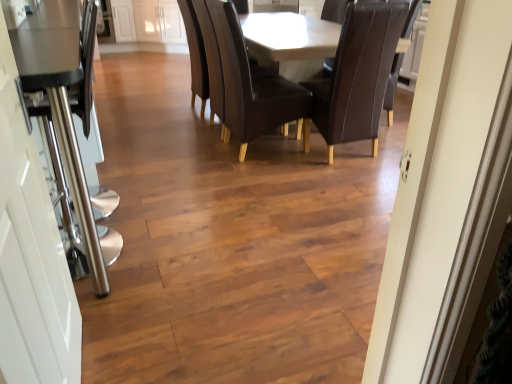
Identify the location of brown leather chair at center, the 2th chair when ordered from left to right. The height and width of the screenshot is (384, 512). (358, 75).

Where is `white glossy door at left`? The width and height of the screenshot is (512, 384). white glossy door at left is located at coordinates (31, 256).

Where is `matte brown table at center`? matte brown table at center is located at coordinates (239, 82).

The image size is (512, 384). In order to click on brown leather chair at center, the 1th chair from the right in this screenshot , I will do `click(358, 75)`.

From a real-world perspective, is matte brown table at center positioned under dark brown leather armchair at center based on gravity?

Indeed, from a real-world perspective, matte brown table at center is positioned beneath dark brown leather armchair at center.

Is matte brown table at center to the left or to the right of dark brown leather armchair at center in the image?

matte brown table at center is positioned on dark brown leather armchair at center's right side.

Is matte brown table at center in front of or behind dark brown leather armchair at center in the image?

matte brown table at center is positioned closer to the viewer than dark brown leather armchair at center.

In the scene shown: Can you tell me how much matte brown table at center and dark brown leather armchair at center differ in facing direction?

There is a 178-degree angle between the facing directions of matte brown table at center and dark brown leather armchair at center.

Considering the sizes of objects brown leather chair at center, the 2th chair when ordered from left to right, and dark brown leather armchair at center in the image provided, who is thinner, brown leather chair at center, the 2th chair when ordered from left to right, or dark brown leather armchair at center?

Thinner between the two is dark brown leather armchair at center.

Is brown leather chair at center, the 1th chair from the right, inside the boundaries of dark brown leather armchair at center, or outside?

brown leather chair at center, the 1th chair from the right, is spatially situated outside dark brown leather armchair at center.

Is brown leather chair at center, the 2th chair when ordered from left to right, oriented towards dark brown leather armchair at center?

No, brown leather chair at center, the 2th chair when ordered from left to right, is not aimed at dark brown leather armchair at center.

The image size is (512, 384). Identify the location of the 2nd chair in front of the dark brown leather armchair at center, starting your count from the anchor. (358, 75).

From the image's perspective, who appears lower, brown leather chair at center, acting as the first chair starting from the left, or matte brown table at center?

brown leather chair at center, acting as the first chair starting from the left, is shown below in the image.

Is brown leather chair at center, which is the 2th chair from right to left, outside of matte brown table at center?

No, brown leather chair at center, which is the 2th chair from right to left, is not entirely external to matte brown table at center.

Considering the relative positions of brown leather chair at center, acting as the first chair starting from the left, and matte brown table at center in the image provided, is brown leather chair at center, acting as the first chair starting from the left, to the right of matte brown table at center from the viewer's perspective?

In fact, brown leather chair at center, acting as the first chair starting from the left, is to the left of matte brown table at center.

Are brown leather chair at center, which is the 2th chair from right to left, and matte brown table at center located far from each other?

No, there isn't a large distance between brown leather chair at center, which is the 2th chair from right to left, and matte brown table at center.

Can you confirm if white glossy door at left is taller than brown leather chair at center, the 1th chair from the right?

Indeed, white glossy door at left has a greater height compared to brown leather chair at center, the 1th chair from the right.

Is white glossy door at left inside or outside of brown leather chair at center, the 2th chair when ordered from left to right?

white glossy door at left cannot be found inside brown leather chair at center, the 2th chair when ordered from left to right.

Is white glossy door at left far from brown leather chair at center, the 1th chair from the right?

Yes.

Between white glossy door at left and brown leather chair at center, the 1th chair from the right, which one has smaller width?

white glossy door at left.

Can you confirm if brown leather chair at center, acting as the first chair starting from the left, is taller than dark brown leather armchair at center?

Indeed, brown leather chair at center, acting as the first chair starting from the left, has a greater height compared to dark brown leather armchair at center.

Is brown leather chair at center, which is the 2th chair from right to left, looking in the opposite direction of dark brown leather armchair at center?

brown leather chair at center, which is the 2th chair from right to left, is not turned away from dark brown leather armchair at center.

From a real-world perspective, which is physically above, brown leather chair at center, acting as the first chair starting from the left, or dark brown leather armchair at center?

brown leather chair at center, acting as the first chair starting from the left, is physically above.

Consider the image. Is white glossy door at left aimed at matte brown table at center?

No, white glossy door at left is not oriented towards matte brown table at center.

From the image's perspective, does white glossy door at left appear lower than matte brown table at center?

Correct, white glossy door at left appears lower than matte brown table at center in the image.

Is white glossy door at left positioned behind matte brown table at center?

No, it is not.

Considering the relative sizes of white glossy door at left and matte brown table at center in the image provided, is white glossy door at left thinner than matte brown table at center?

Correct, the width of white glossy door at left is less than that of matte brown table at center.

Is brown leather chair at center, the 1th chair from the right, situated inside matte brown table at center or outside?

brown leather chair at center, the 1th chair from the right, is located inside matte brown table at center.

From the image's perspective, would you say brown leather chair at center, the 2th chair when ordered from left to right, is positioned over matte brown table at center?

Incorrect, from the image's perspective, brown leather chair at center, the 2th chair when ordered from left to right, is lower than matte brown table at center.

Is brown leather chair at center, the 2th chair when ordered from left to right, looking in the opposite direction of matte brown table at center?

Yes, brown leather chair at center, the 2th chair when ordered from left to right, is positioned with its back facing matte brown table at center.

Is brown leather chair at center, the 2th chair when ordered from left to right, with matte brown table at center?

No, brown leather chair at center, the 2th chair when ordered from left to right, is not next to matte brown table at center.

Locate an element on the screen. kitchen & dining room table that appears in front of the dark brown leather armchair at center is located at coordinates (239, 82).

This screenshot has height=384, width=512. I want to click on armchair that is above the brown leather chair at center, the 1th chair from the right (from the image's perspective), so click(212, 60).

From the image, which object appears to be nearer to dark brown leather armchair at center, matte brown table at center or white glossy door at left?

matte brown table at center.

Looking at the image, which one is located further to brown leather chair at center, acting as the first chair starting from the left, matte brown table at center or white glossy door at left?

white glossy door at left.

Estimate the real-world distances between objects in this image. Which object is further from matte brown table at center, dark brown leather armchair at center or brown leather chair at center, which is the 2th chair from right to left?

The object further to matte brown table at center is dark brown leather armchair at center.

Which object lies further to the anchor point brown leather chair at center, the 1th chair from the right, brown leather chair at center, which is the 2th chair from right to left, or white glossy door at left?

Among the two, white glossy door at left is located further to brown leather chair at center, the 1th chair from the right.

Based on the photo, when comparing their distances from white glossy door at left, does brown leather chair at center, the 1th chair from the right, or dark brown leather armchair at center seem closer?

Among the two, dark brown leather armchair at center is located nearer to white glossy door at left.

Considering their positions, is brown leather chair at center, acting as the first chair starting from the left, positioned further to matte brown table at center than dark brown leather armchair at center?

Based on the image, dark brown leather armchair at center appears to be further to matte brown table at center.

Based on their spatial positions, is white glossy door at left or dark brown leather armchair at center further from brown leather chair at center, which is the 2th chair from right to left?

Among the two, white glossy door at left is located further to brown leather chair at center, which is the 2th chair from right to left.

Estimate the real-world distances between objects in this image. Which object is closer to white glossy door at left, dark brown leather armchair at center or matte brown table at center?

matte brown table at center is positioned closer to the anchor white glossy door at left.

I want to click on chair located between white glossy door at left and brown leather chair at center, which is the 2th chair from right to left, in the depth direction, so click(358, 75).

Where is `kitchen & dining room table positioned between brown leather chair at center, the 2th chair when ordered from left to right, and dark brown leather armchair at center from near to far`? The width and height of the screenshot is (512, 384). kitchen & dining room table positioned between brown leather chair at center, the 2th chair when ordered from left to right, and dark brown leather armchair at center from near to far is located at coordinates (239, 82).

Identify the location of chair located between brown leather chair at center, the 1th chair from the right, and dark brown leather armchair at center in the depth direction. (252, 85).

What are the coordinates of `kitchen & dining room table between brown leather chair at center, acting as the first chair starting from the left, and brown leather chair at center, the 2th chair when ordered from left to right` in the screenshot? It's located at (239, 82).